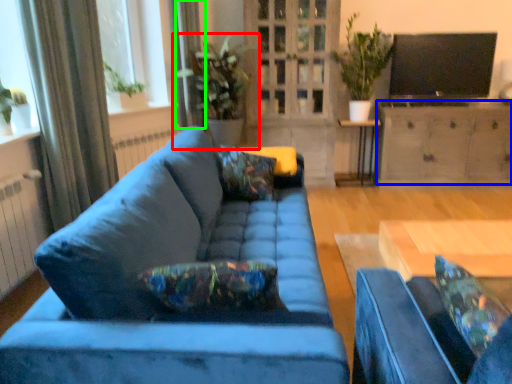
Question: Which object is the farthest from houseplant (highlighted by a red box)? Choose among these: cabinetry (highlighted by a blue box) or curtain (highlighted by a green box).

Choices:
 (A) cabinetry
 (B) curtain

Answer: (A)